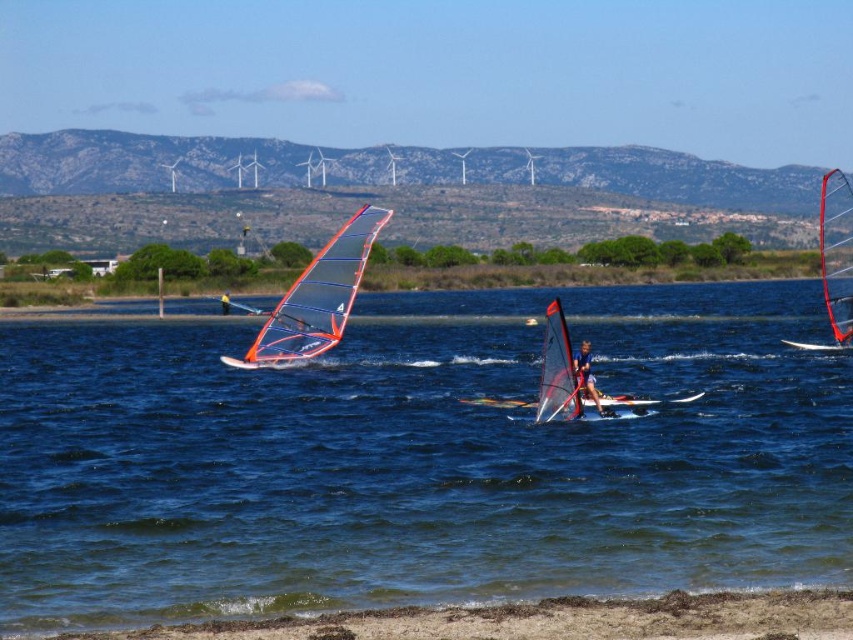
Question: Does orange glossy sail at center have a larger size compared to matte orange windsurfing board at center?

Choices:
 (A) yes
 (B) no

Answer: (B)

Question: Among these points, which one is farthest from the camera?

Choices:
 (A) (822, 244)
 (B) (222, 308)
 (C) (270, 344)

Answer: (B)

Question: Which point is farther to the camera?

Choices:
 (A) matte orange windsurfing board at center
 (B) orange glossy sail at center
 (C) blue water at center
 (D) blue matte windsurfing sail at center

Answer: (A)

Question: Which object is positioned farthest from the blue matte windsurfing sail at center?

Choices:
 (A) orange glossy sail at center
 (B) blue water at center
 (C) matte orange windsurfing board at center

Answer: (C)

Question: Does blue water at center have a smaller size compared to orange glossy sail at center?

Choices:
 (A) yes
 (B) no

Answer: (B)

Question: Observing the image, what is the correct spatial positioning of blue water at center in reference to red matte sail at right?

Choices:
 (A) above
 (B) below

Answer: (B)